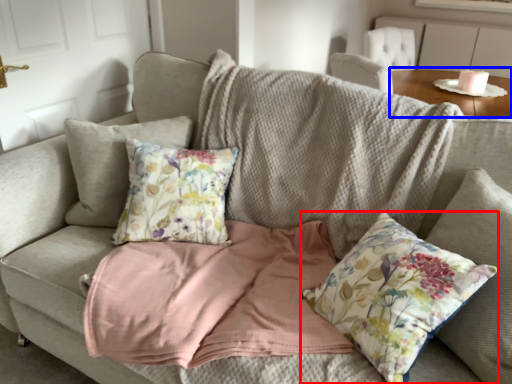
Question: Which of the following is the closest to the observer, pillow (highlighted by a red box) or table (highlighted by a blue box)?

Choices:
 (A) pillow
 (B) table

Answer: (A)